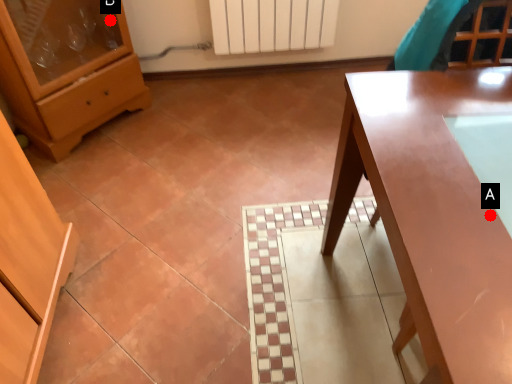
Question: Two points are circled on the image, labeled by A and B beside each circle. Which point appears closest to the camera in this image?

Choices:
 (A) A is closer
 (B) B is closer

Answer: (A)